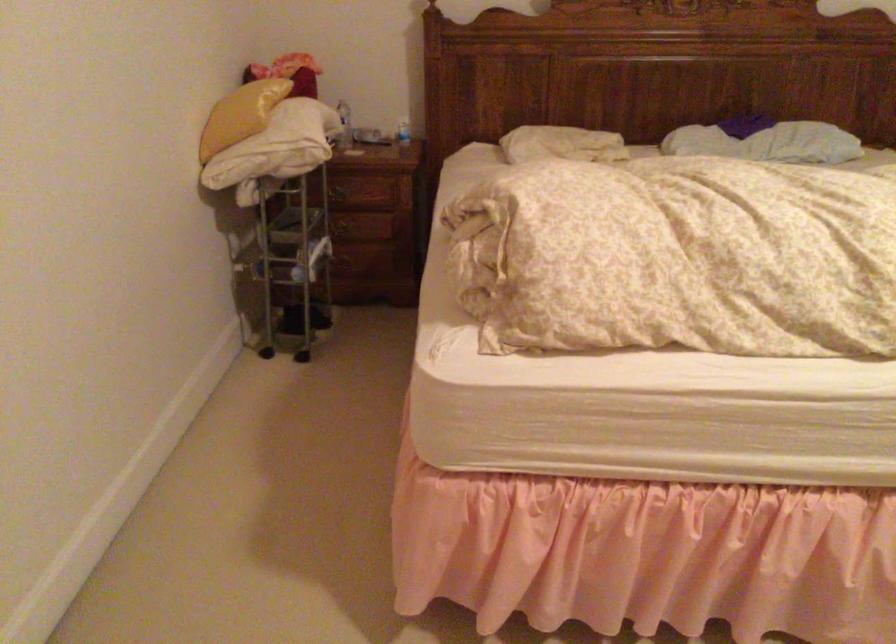
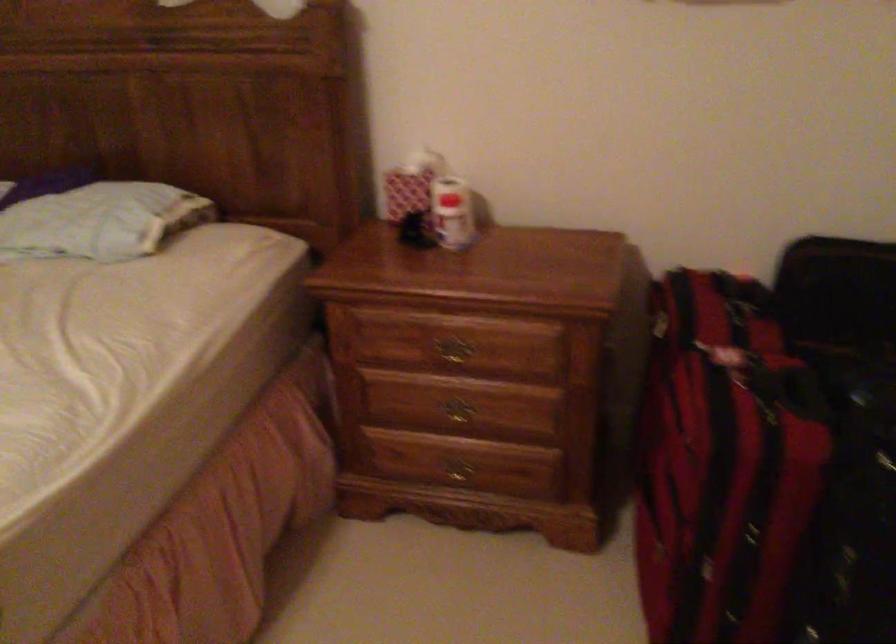
What movement of the cameraman would produce the second image?

The cameraman moved toward right, forward.